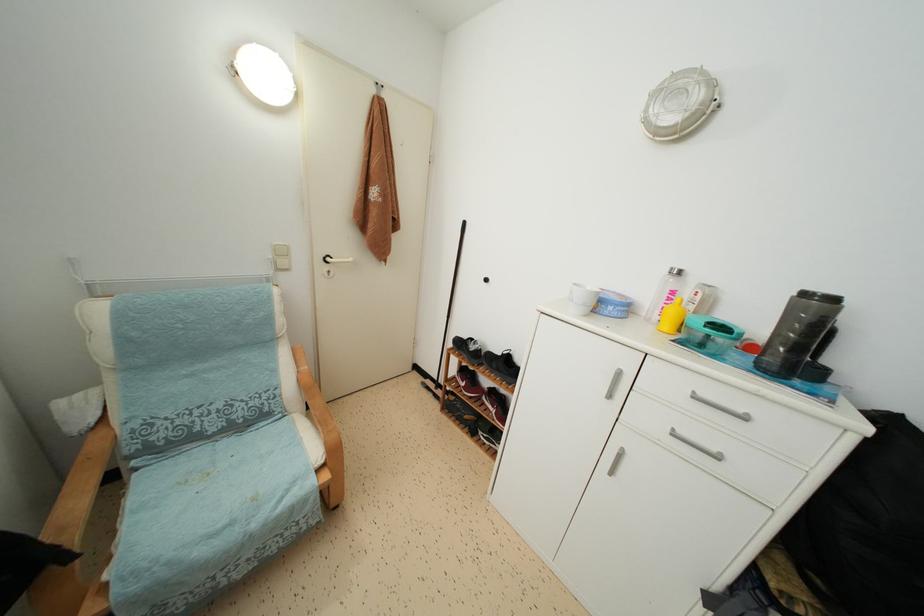
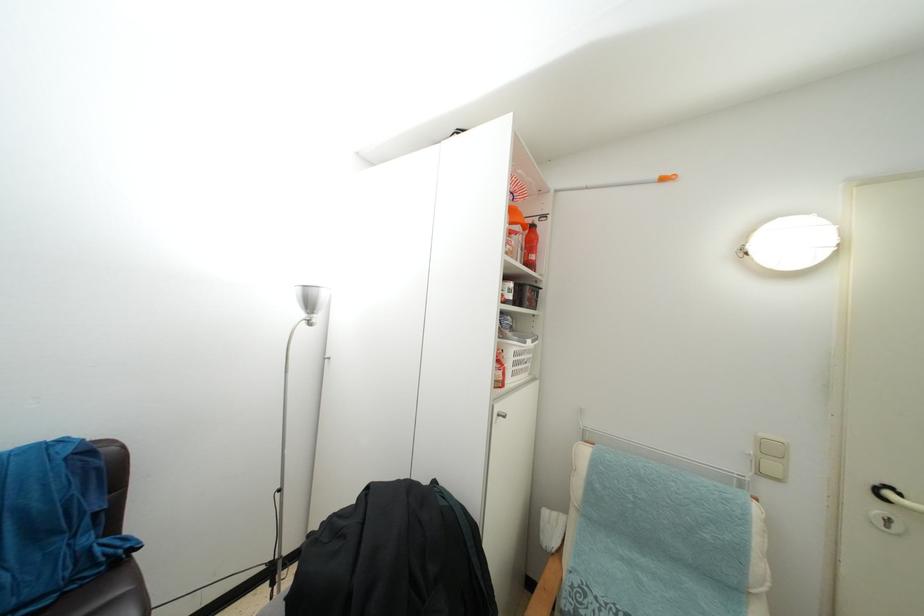
Question: The camera is either moving clockwise (left) or counter-clockwise (right) around the object. The first image is from the beginning of the video and the second image is from the end. Is the camera moving left or right when shooting the video?

Choices:
 (A) Left
 (B) Right

Answer: (B)